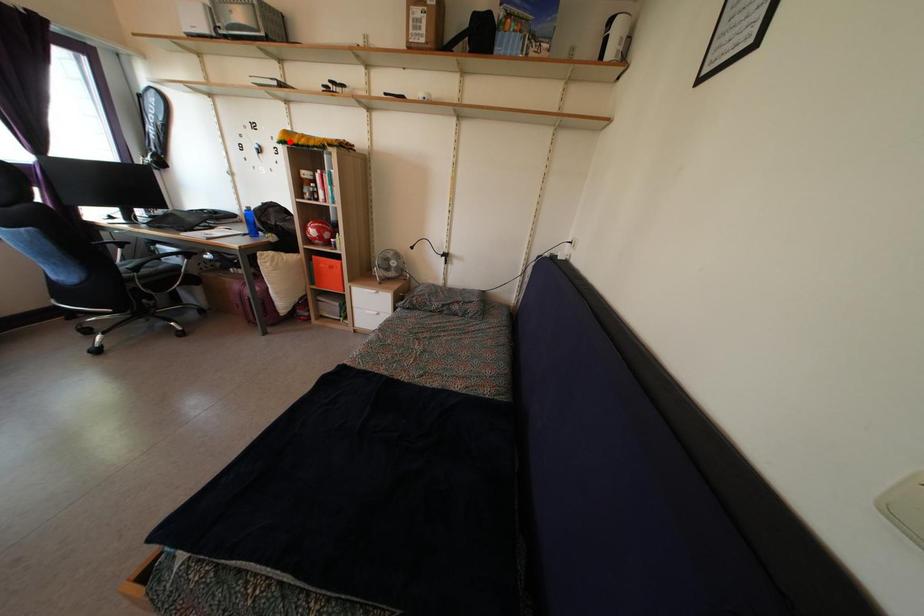
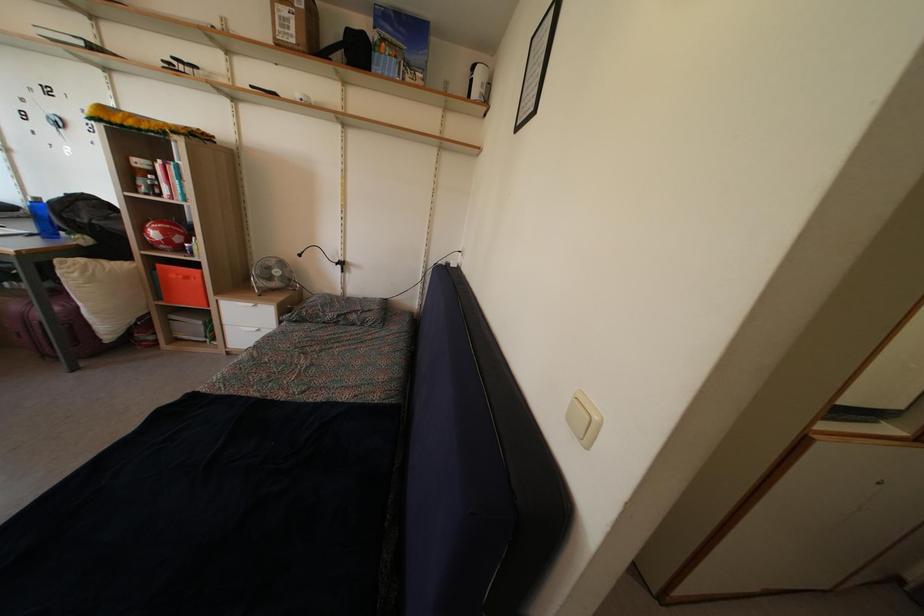
In the second image, find the point that corresponds to the highlighted location in the first image.

(106, 116)